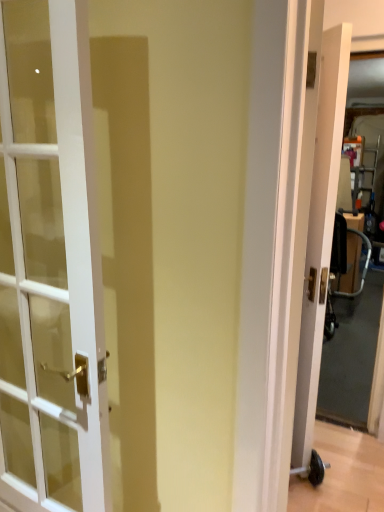
Question: Is point (334, 224) closer or farther from the camera than point (317, 339)?

Choices:
 (A) closer
 (B) farther

Answer: (B)

Question: Considering their positions, is metallic silver baby carriage at right located in front of or behind white wood door at right, the 2th door from the left?

Choices:
 (A) front
 (B) behind

Answer: (B)

Question: Which of these objects is positioned farthest from the white glass door at left, placed as the 1th door when sorted from left to right?

Choices:
 (A) white wood door at right, which ranks as the second door in front-to-back order
 (B) metallic silver baby carriage at right

Answer: (B)

Question: Estimate the real-world distances between objects in this image. Which object is farther from the white glass door at left, which appears as the second door when viewed from the back?

Choices:
 (A) metallic silver baby carriage at right
 (B) white wood door at right, which ranks as the second door in front-to-back order

Answer: (A)